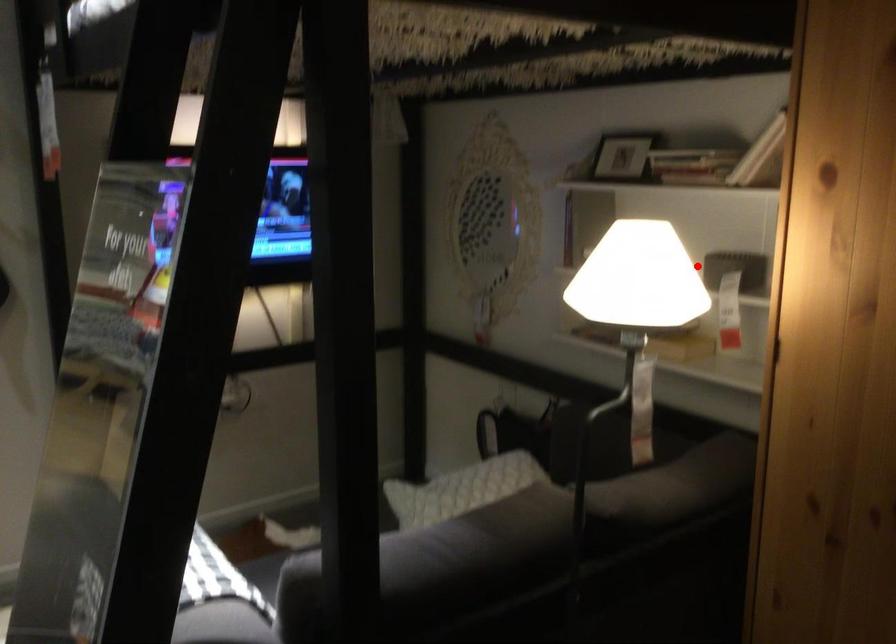
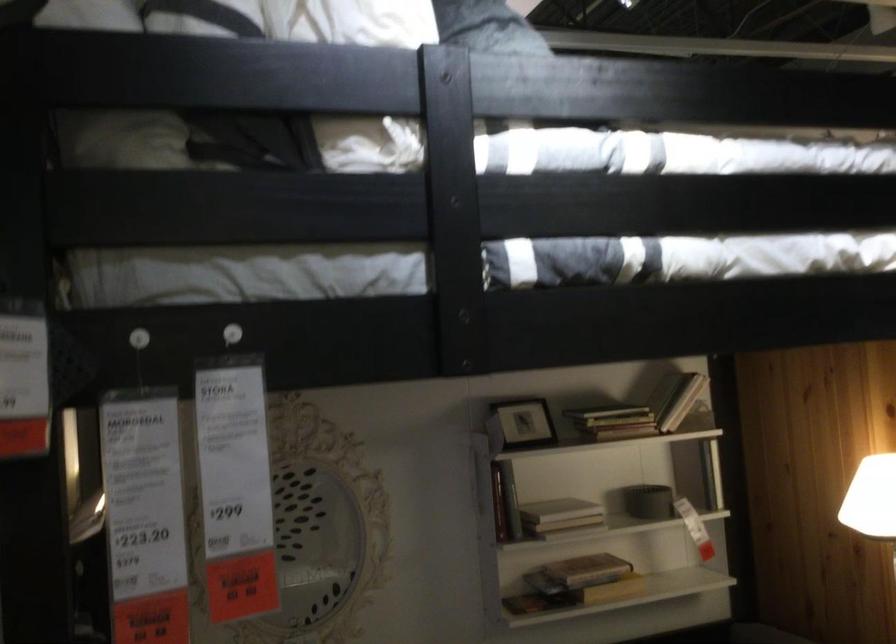
Locate, in the second image, the point that corresponds to the highlighted location in the first image.

(648, 502)